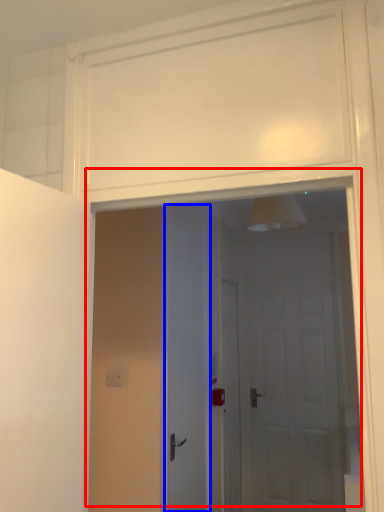
Question: Which of the following is the farthest to the observer, door (highlighted by a red box) or door (highlighted by a blue box)?

Choices:
 (A) door
 (B) door

Answer: (B)